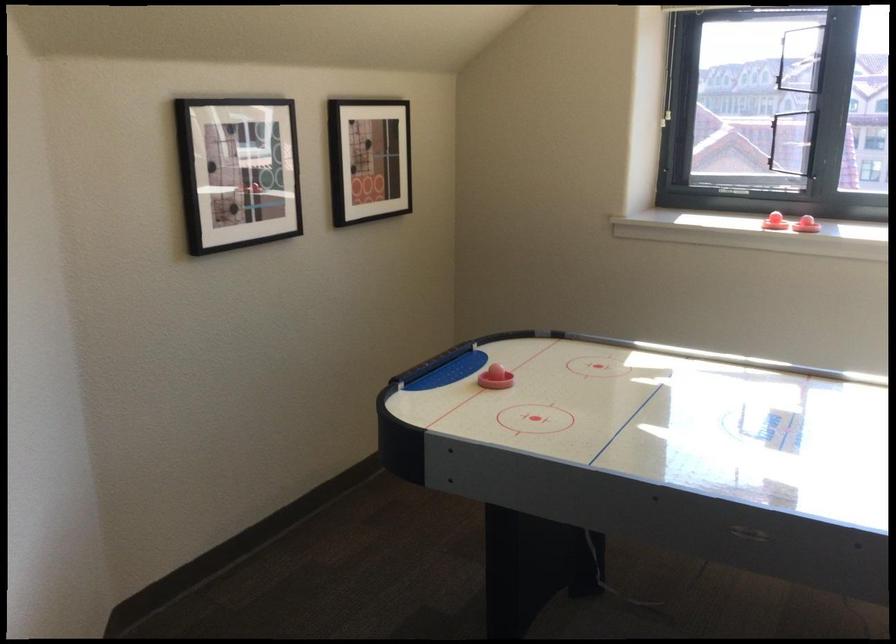
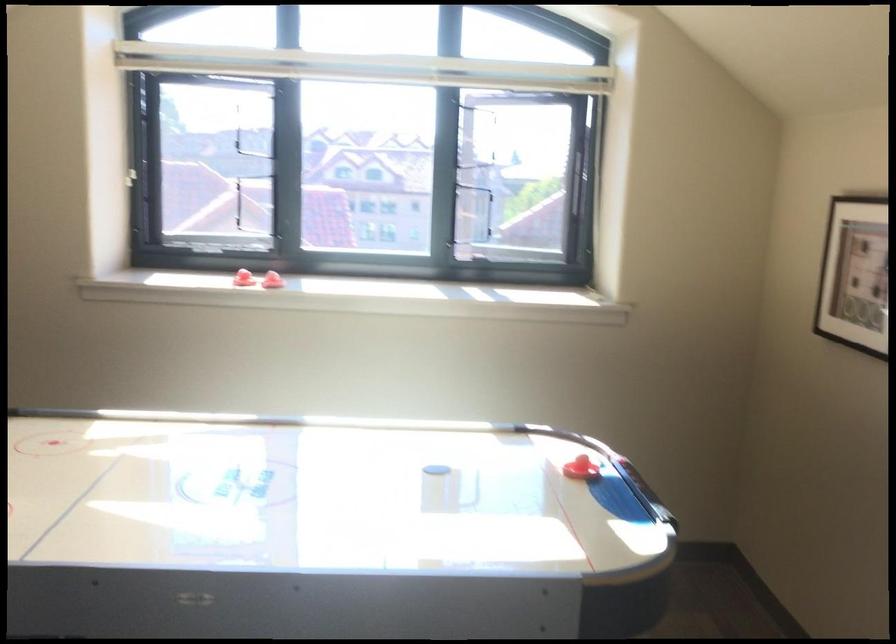
Question: The camera is either moving clockwise (left) or counter-clockwise (right) around the object. The first image is from the beginning of the video and the second image is from the end. Is the camera moving left or right when shooting the video?

Choices:
 (A) Left
 (B) Right

Answer: (A)